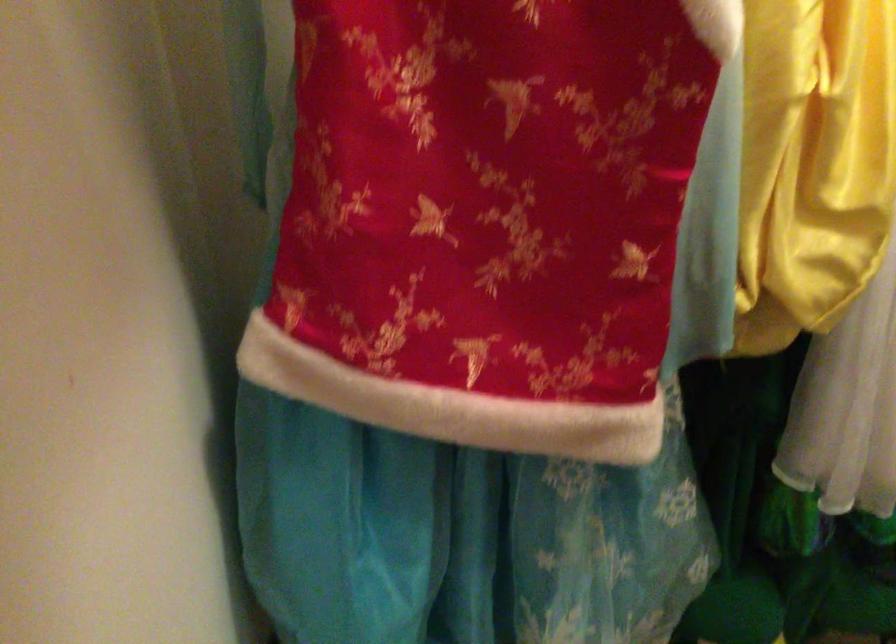
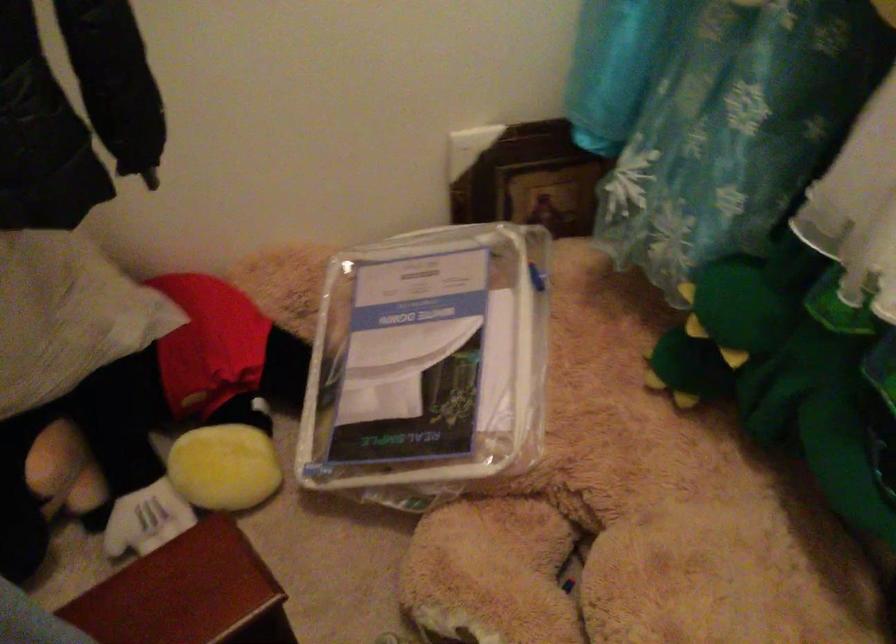
First-person continuous shooting, in which direction is the camera rotating?

The camera's rotation is toward left-down.